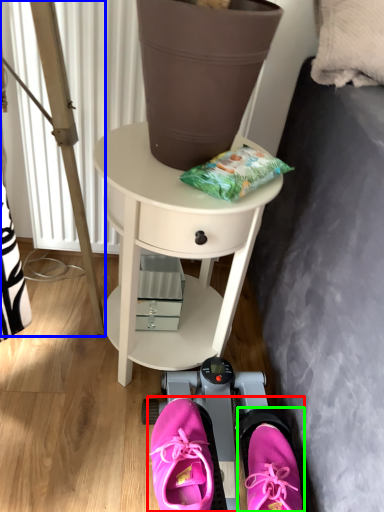
Question: Based on their relative distances, which object is farther from couple (highlighted by a red box)? Choose from ladder (highlighted by a blue box) and footwear (highlighted by a green box).

Choices:
 (A) ladder
 (B) footwear

Answer: (A)